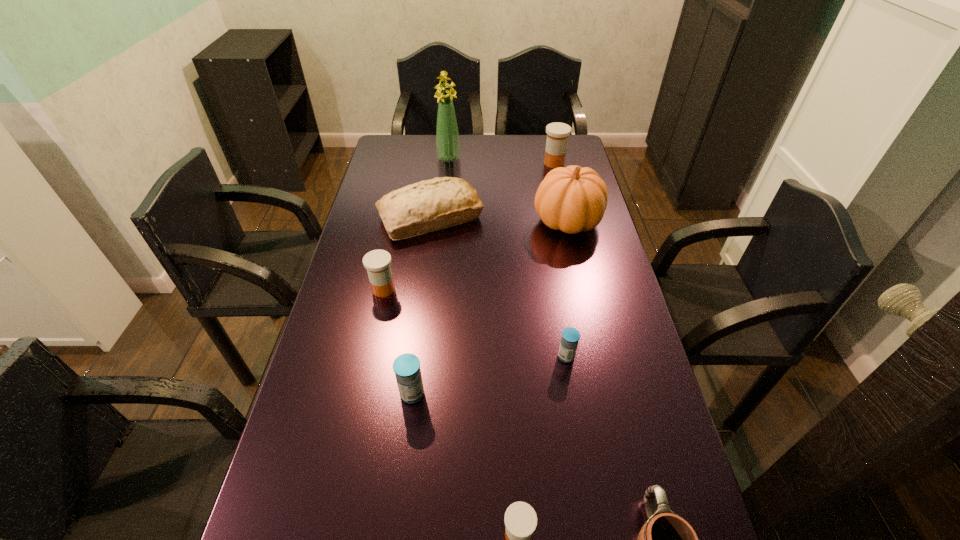
Where is `the left blue medicine`? Image resolution: width=960 pixels, height=540 pixels. the left blue medicine is located at coordinates (407, 370).

Where is `the third farthest medicine`? Image resolution: width=960 pixels, height=540 pixels. the third farthest medicine is located at coordinates (570, 336).

Where is `the farther blue medicine`? The image size is (960, 540). the farther blue medicine is located at coordinates (570, 336).

Find the location of a particular element. vacant region located 0.230m on the front-facing side of the tallest object is located at coordinates (445, 198).

You are a GUI agent. You are given a task and a screenshot of the screen. Output one action in this format:
    pyautogui.click(x=<x>, y=<y>)
    Task: Click on the free region located on the left of the second tallest object
    
    Given the screenshot: What is the action you would take?
    pyautogui.click(x=492, y=221)

The width and height of the screenshot is (960, 540). Find the location of `free space located on the label of the farthest medicine`. free space located on the label of the farthest medicine is located at coordinates (497, 163).

The width and height of the screenshot is (960, 540). I want to click on vacant area situated 0.390m on the label of the farthest medicine, so click(x=444, y=163).

Find the location of a particular element. This screenshot has height=540, width=960. vacant point located 0.360m on the label of the farthest medicine is located at coordinates (452, 163).

Where is `vacant area situated on the front of the bread`? The height and width of the screenshot is (540, 960). vacant area situated on the front of the bread is located at coordinates (416, 334).

Where is `free space located on the label of the second biggest orange medicine`? The image size is (960, 540). free space located on the label of the second biggest orange medicine is located at coordinates (463, 289).